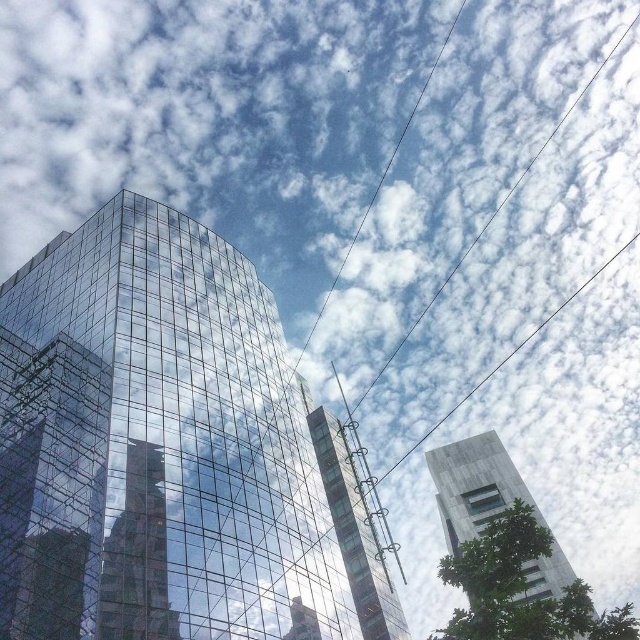
Question: Is transparent glass building at center smaller than gray concrete tower at right?

Choices:
 (A) no
 (B) yes

Answer: (A)

Question: Among these points, which one is nearest to the camera?

Choices:
 (A) (545, 522)
 (B) (220, 570)
 (C) (339, 456)

Answer: (B)

Question: Which point is closer to the camera?

Choices:
 (A) (353, 502)
 (B) (227, 474)
 (C) (504, 486)

Answer: (B)

Question: Is transparent glass building at center further to the viewer compared to transparent glass tower at center?

Choices:
 (A) yes
 (B) no

Answer: (B)

Question: Can you confirm if gray concrete tower at right is positioned to the left of transparent glass tower at center?

Choices:
 (A) yes
 (B) no

Answer: (B)

Question: Which of these objects is positioned closest to the gray concrete tower at right?

Choices:
 (A) transparent glass tower at center
 (B) transparent glass building at center

Answer: (A)